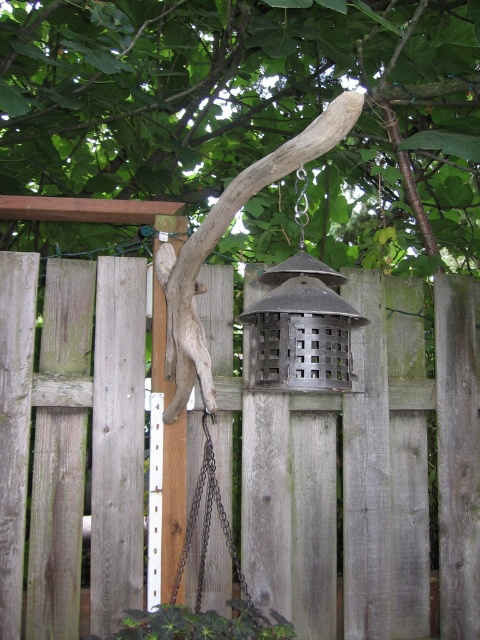
Is point (297, 349) closer to viewer compared to point (176, 333)?

Yes.

Is metallic wire mesh bird cage at center to the right of brown rough wood branch at center from the viewer's perspective?

Yes, metallic wire mesh bird cage at center is to the right of brown rough wood branch at center.

This screenshot has width=480, height=640. Find the location of `metallic wire mesh bird cage at center`. metallic wire mesh bird cage at center is located at coordinates (302, 320).

Who is more distant from viewer, (302,499) or (321,348)?

The point (302,499) is more distant.

Between weathered wood fence at center and metallic wire mesh bird cage at center, which one appears on the left side from the viewer's perspective?

From the viewer's perspective, weathered wood fence at center appears more on the left side.

Where is `weathered wood fence at center`? weathered wood fence at center is located at coordinates (371, 467).

At what (x,y) coordinates should I click in order to perform the action: click on weathered wood fence at center. Please return your answer as a coordinate pair (x, y). Looking at the image, I should click on (371, 467).

Between metallic wire mesh bird cage at center and black metal chain at center, which one has more height?

black metal chain at center is taller.

Between metallic wire mesh bird cage at center and black metal chain at center, which one is positioned lower?

black metal chain at center is lower down.

Does point (311, 292) come closer to viewer compared to point (201, 474)?

Yes, point (311, 292) is closer to viewer.

Where is `metallic wire mesh bird cage at center`? The image size is (480, 640). metallic wire mesh bird cage at center is located at coordinates (302, 320).